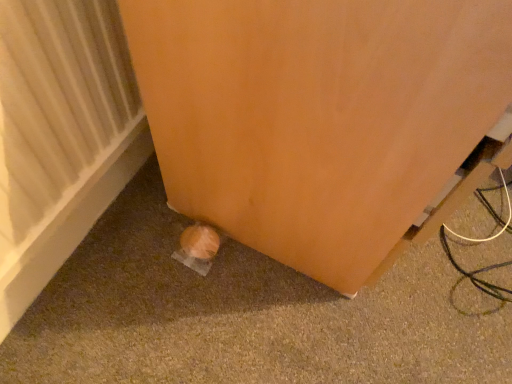
What do you see at coordinates (323, 119) in the screenshot? This screenshot has width=512, height=384. I see `matte orange door at lower left` at bounding box center [323, 119].

Where is `matte orange door at lower left`? matte orange door at lower left is located at coordinates (323, 119).

In order to face white textured radiator at lower left, should I rotate leftwards or rightwards?

You should rotate left by 27.280 degrees.

What do you see at coordinates (59, 100) in the screenshot? I see `white textured radiator at lower left` at bounding box center [59, 100].

Measure the distance between white textured radiator at lower left and camera.

The depth of white textured radiator at lower left is 17.50 inches.

In order to click on white textured radiator at lower left in this screenshot , I will do `click(59, 100)`.

Image resolution: width=512 pixels, height=384 pixels. What are the coordinates of `matte orange door at lower left` in the screenshot? It's located at (323, 119).

Considering the positions of objects matte orange door at lower left and white textured radiator at lower left in the image provided, who is more to the right, matte orange door at lower left or white textured radiator at lower left?

matte orange door at lower left is more to the right.

Which object is further away from the camera, matte orange door at lower left or white textured radiator at lower left?

white textured radiator at lower left is further away from the camera.

Does point (305, 230) come in front of point (106, 122)?

Yes, point (305, 230) is closer to viewer.

From the image's perspective, between matte orange door at lower left and white textured radiator at lower left, who is located below?

white textured radiator at lower left is shown below in the image.

From the picture: From a real-world perspective, is matte orange door at lower left over white textured radiator at lower left?

Yes, from a real-world perspective, matte orange door at lower left is over white textured radiator at lower left

Does matte orange door at lower left have a greater width compared to white textured radiator at lower left?

Yes.

Is matte orange door at lower left taller or shorter than white textured radiator at lower left?

In the image, matte orange door at lower left appears to be taller than white textured radiator at lower left.

Based on their sizes in the image, would you say matte orange door at lower left is bigger or smaller than white textured radiator at lower left?

matte orange door at lower left is bigger than white textured radiator at lower left.

Is matte orange door at lower left inside the boundaries of white textured radiator at lower left, or outside?

matte orange door at lower left lies outside white textured radiator at lower left.

Are matte orange door at lower left and white textured radiator at lower left far apart?

That's not correct — matte orange door at lower left is a little close to white textured radiator at lower left.

Is matte orange door at lower left oriented towards white textured radiator at lower left?

No.

Measure the distance from matte orange door at lower left to white textured radiator at lower left.

9.93 inches.

The height and width of the screenshot is (384, 512). In order to click on furniture lying on the right of white textured radiator at lower left in this screenshot , I will do `click(323, 119)`.

Which object is positioned more to the right, white textured radiator at lower left or matte orange door at lower left?

matte orange door at lower left.

Is white textured radiator at lower left behind matte orange door at lower left?

Yes, white textured radiator at lower left is further from the camera.

Which is less distant, (12, 199) or (290, 107)?

Positioned in front is point (290, 107).

From the image's perspective, who appears lower, white textured radiator at lower left or matte orange door at lower left?

From the image's view, white textured radiator at lower left is below.

From a real-world perspective, which is physically below, white textured radiator at lower left or matte orange door at lower left?

white textured radiator at lower left.

Which object is wider, white textured radiator at lower left or matte orange door at lower left?

matte orange door at lower left.

Between white textured radiator at lower left and matte orange door at lower left, which one has less height?

Standing shorter between the two is white textured radiator at lower left.

Can you confirm if white textured radiator at lower left is smaller than matte orange door at lower left?

Yes.

Would you say matte orange door at lower left is part of white textured radiator at lower left's contents?

No, matte orange door at lower left is not a part of white textured radiator at lower left.

Would you consider white textured radiator at lower left to be distant from matte orange door at lower left?

No, white textured radiator at lower left is in close proximity to matte orange door at lower left.

Could you tell me if white textured radiator at lower left is turned towards matte orange door at lower left?

Yes, white textured radiator at lower left faces towards matte orange door at lower left.

What's the angular difference between white textured radiator at lower left and matte orange door at lower left's facing directions?

There is a 1.44-degree angle between the facing directions of white textured radiator at lower left and matte orange door at lower left.

Measure the distance from white textured radiator at lower left to matte orange door at lower left.

9.93 inches.

Find the location of a particular element. furniture lying above the white textured radiator at lower left (from the image's perspective) is located at coordinates point(323,119).

Image resolution: width=512 pixels, height=384 pixels. Identify the location of radiator below the matte orange door at lower left (from a real-world perspective). (59, 100).

Locate an element on the screen. This screenshot has width=512, height=384. furniture in front of the white textured radiator at lower left is located at coordinates (323, 119).